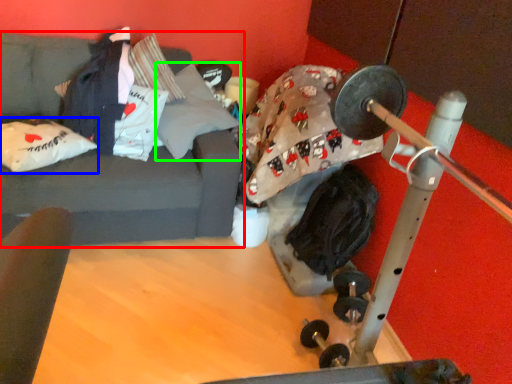
Question: Which object is positioned closest to studio couch (highlighted by a red box)? Select from pillow (highlighted by a blue box) and pillow (highlighted by a green box).

Choices:
 (A) pillow
 (B) pillow

Answer: (A)